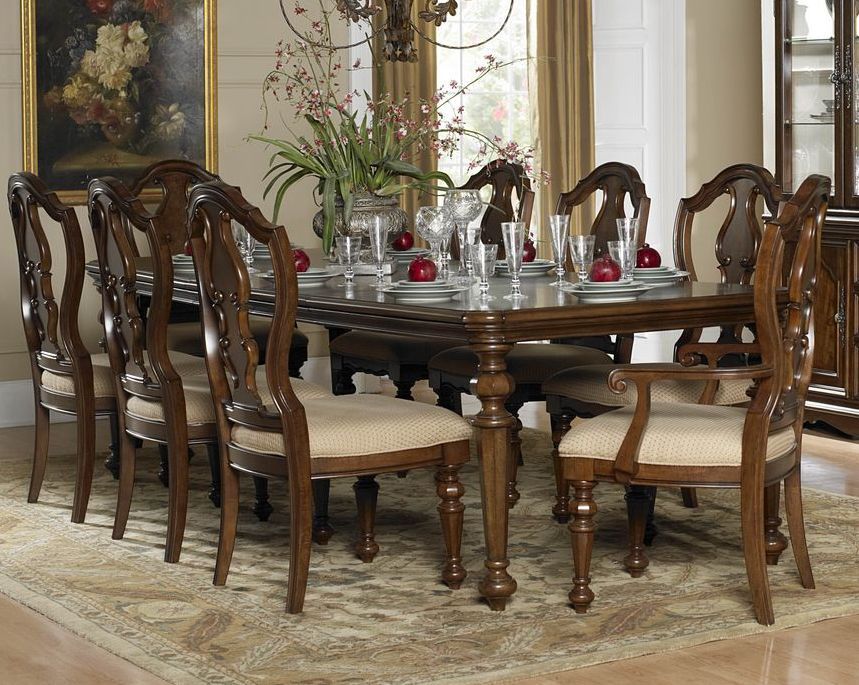
Locate an element on the screen. The image size is (859, 685). beige cushion in chairs is located at coordinates (385, 432), (198, 409), (101, 379), (705, 436), (733, 383), (529, 364), (396, 348), (186, 334).